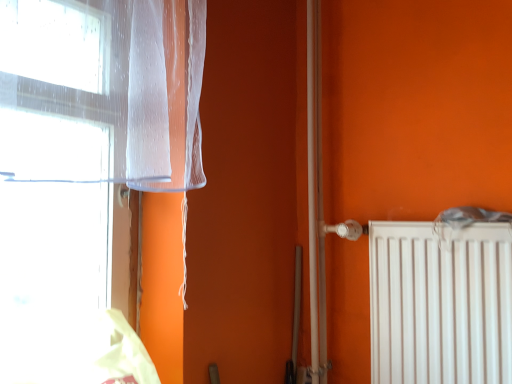
The image size is (512, 384). What do you see at coordinates (440, 303) in the screenshot?
I see `white matte radiator at right` at bounding box center [440, 303].

At what (x,y) coordinates should I click in order to perform the action: click on white matte radiator at right. Please return your answer as a coordinate pair (x, y). The height and width of the screenshot is (384, 512). Looking at the image, I should click on (440, 303).

Where is `white matte radiator at right`? white matte radiator at right is located at coordinates (440, 303).